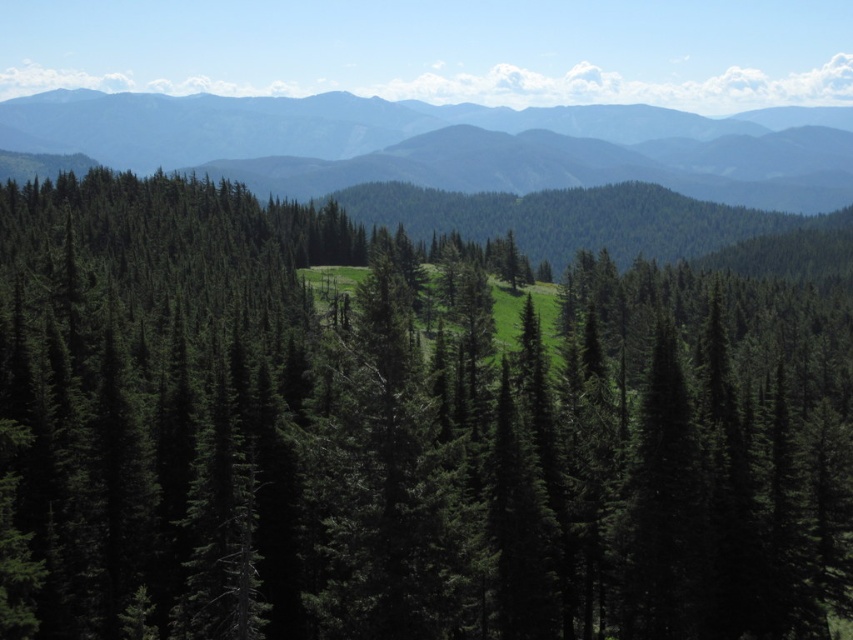
Question: Among these points, which one is farthest from the camera?

Choices:
 (A) (784, 596)
 (B) (787, 192)

Answer: (B)

Question: Does green matte tree at center appear on the left side of green forested mountain range at upper center?

Choices:
 (A) no
 (B) yes

Answer: (A)

Question: Which point is farther from the camera taking this photo?

Choices:
 (A) (747, 602)
 (B) (288, 108)

Answer: (B)

Question: Which point is closer to the camera?

Choices:
 (A) (363, 129)
 (B) (364, 536)

Answer: (B)

Question: Is green matte tree at center bigger than green forested mountain range at upper center?

Choices:
 (A) yes
 (B) no

Answer: (B)

Question: Can you confirm if green matte tree at center is wider than green forested mountain range at upper center?

Choices:
 (A) no
 (B) yes

Answer: (A)